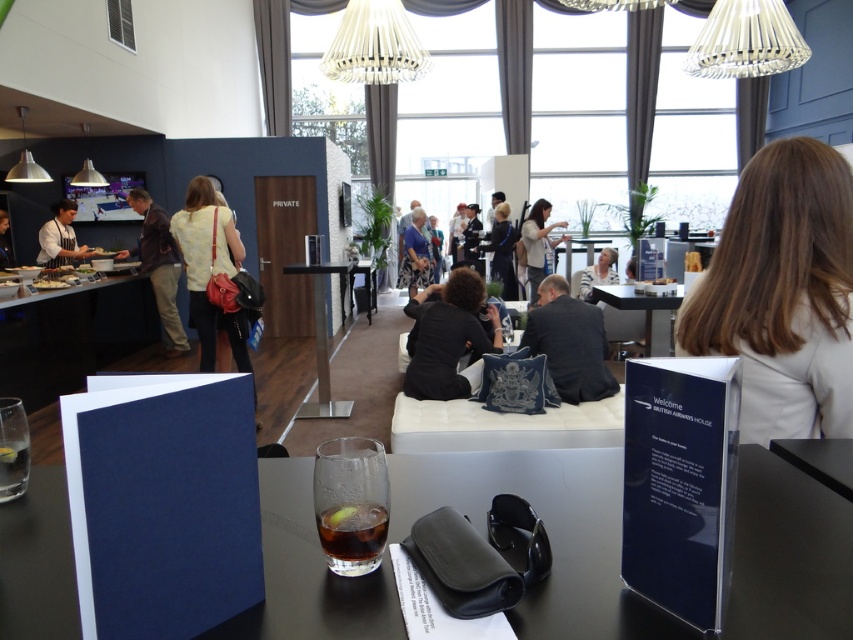
Question: Which object is positioned farthest from the dark gray suit at center?

Choices:
 (A) matte black glass at center
 (B) white chef coat at left
 (C) silver metallic table at center
 (D) white textured chandelier at upper center

Answer: (B)

Question: Estimate the real-world distances between objects in this image. Which object is closer to the smooth white cheese at center?

Choices:
 (A) dark gray suit at center
 (B) white fabric chair at center

Answer: (A)

Question: Is dark glass at center positioned before wooden table at center?

Choices:
 (A) no
 (B) yes

Answer: (B)

Question: Which point appears closest to the camera in this image?

Choices:
 (A) (347, 35)
 (B) (437, 346)
 (C) (775, 316)
 (D) (422, 280)

Answer: (C)

Question: Does dark brown leather jacket at left appear under matte black apron at left?

Choices:
 (A) no
 (B) yes

Answer: (B)

Question: Does white woven chandelier at upper center have a greater width compared to white textured chandelier at upper center?

Choices:
 (A) yes
 (B) no

Answer: (B)